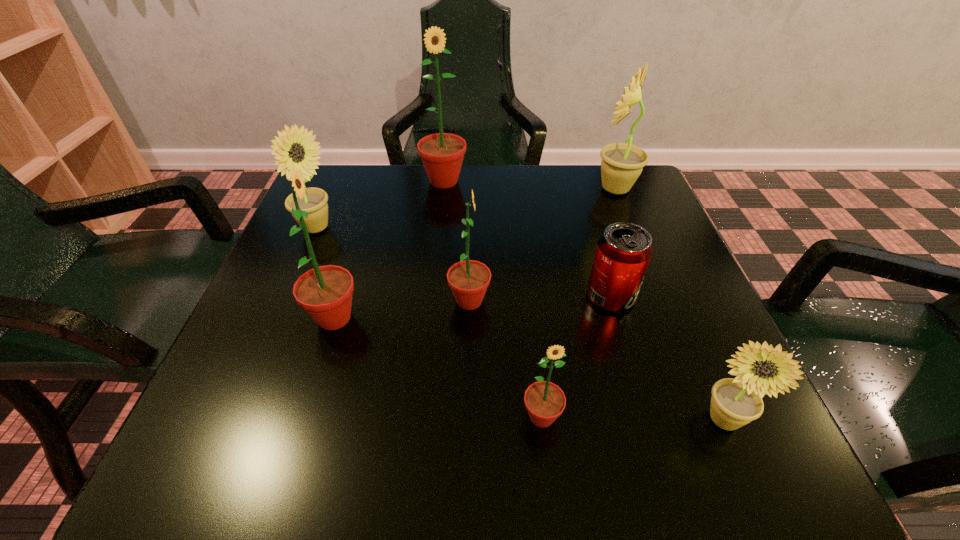
The height and width of the screenshot is (540, 960). Find the location of `empty location between the nearest yellow sunflower and the soda can`. empty location between the nearest yellow sunflower and the soda can is located at coordinates (666, 358).

Where is `object that stands as the fifth closest to the leftmost sunflower`? The image size is (960, 540). object that stands as the fifth closest to the leftmost sunflower is located at coordinates (545, 401).

Where is `object that is the third closest to the nearest yellow sunflower`? The image size is (960, 540). object that is the third closest to the nearest yellow sunflower is located at coordinates point(469,279).

Select which sunflower appears as the second closest to the nearest green sunflower. Please provide its 2D coordinates. Your answer should be formatted as a tuple, i.e. [(x, y)], where the tuple contains the x and y coordinates of a point satisfying the conditions above.

[(735, 402)]

This screenshot has height=540, width=960. I want to click on sunflower object that ranks as the second closest to the third biggest green sunflower, so click(x=545, y=401).

Locate which green sunflower ranks fourth in proximity to the shortest object. Please provide its 2D coordinates. Your answer should be formatted as a tuple, i.e. [(x, y)], where the tuple contains the x and y coordinates of a point satisfying the conditions above.

[(325, 293)]

Identify the location of green sunflower that can be found as the third closest to the farthest yellow sunflower. The width and height of the screenshot is (960, 540). (545, 401).

Locate an element on the screen. The height and width of the screenshot is (540, 960). yellow sunflower that is the closest one to the biggest yellow sunflower is located at coordinates (735, 402).

Locate an element on the screen. This screenshot has height=540, width=960. yellow sunflower that is the closest to the fourth object from right to left is located at coordinates (735, 402).

This screenshot has width=960, height=540. I want to click on vacant space that satisfies the following two spatial constraints: 1. on the face of the farthest yellow sunflower; 2. on the face of the nearest green sunflower, so click(707, 417).